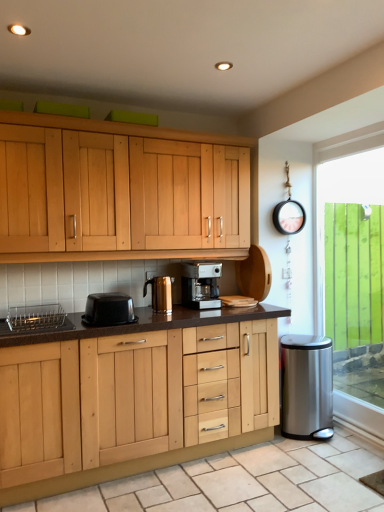
What are the coordinates of `stainless steel trash can at right, the 2th appliance positioned from the front` in the screenshot? It's located at (307, 386).

Describe the element at coordinates (160, 293) in the screenshot. I see `metallic silver kettle at center, which appears as the first kitchen appliance when viewed from the back` at that location.

Locate an element on the screen. The width and height of the screenshot is (384, 512). beige tile at lower center is located at coordinates (242, 481).

Which is more to the right, silver metallic dish rack at lower left, acting as the second appliance starting from the right, or black plastic container at center, placed as the 2th kitchen appliance when sorted from right to left?

black plastic container at center, placed as the 2th kitchen appliance when sorted from right to left.

Is silver metallic dish rack at lower left, marked as the 2th appliance in a bottom-to-top arrangement, positioned before black plastic container at center, placed as the 2th kitchen appliance when sorted from back to front?

Yes.

From the image's perspective, is silver metallic dish rack at lower left, acting as the second appliance starting from the right, located beneath black plastic container at center, which ranks as the first kitchen appliance in front-to-back order?

Correct, silver metallic dish rack at lower left, acting as the second appliance starting from the right, appears lower than black plastic container at center, which ranks as the first kitchen appliance in front-to-back order, in the image.

Considering the sizes of objects silver metallic dish rack at lower left, which is the 2th appliance from back to front, and black plastic container at center, placed as the 2th kitchen appliance when sorted from right to left, in the image provided, who is bigger, silver metallic dish rack at lower left, which is the 2th appliance from back to front, or black plastic container at center, placed as the 2th kitchen appliance when sorted from right to left,?

Bigger between the two is black plastic container at center, placed as the 2th kitchen appliance when sorted from right to left.

Is beige tile at lower center completely or partially inside silver metallic dish rack at lower left, marked as the 2th appliance in a bottom-to-top arrangement?

No, beige tile at lower center is not a part of silver metallic dish rack at lower left, marked as the 2th appliance in a bottom-to-top arrangement.

Between silver metallic dish rack at lower left, which is the 2th appliance from back to front, and beige tile at lower center, which one has less height?

Standing shorter between the two is beige tile at lower center.

Is silver metallic dish rack at lower left, which is the 2th appliance from back to front, far away from beige tile at lower center?

That's right, there is a large distance between silver metallic dish rack at lower left, which is the 2th appliance from back to front, and beige tile at lower center.

Is black plastic container at center, placed as the 2th kitchen appliance when sorted from back to front, to the right of satin silver coffee maker at center from the viewer's perspective?

No.

Between point (119, 311) and point (209, 273), which one is positioned in front?

The point (119, 311) is more forward.

Is black plastic container at center, which ranks as the first kitchen appliance in front-to-back order, taller or shorter than satin silver coffee maker at center?

Clearly, black plastic container at center, which ranks as the first kitchen appliance in front-to-back order, is shorter compared to satin silver coffee maker at center.

In the scene shown: Is satin silver coffee maker at center at the back of black plastic container at center, which ranks as the first kitchen appliance in front-to-back order?

black plastic container at center, which ranks as the first kitchen appliance in front-to-back order, does not have its back to satin silver coffee maker at center.

Is metallic silver kettle at center, marked as the second kitchen appliance in a left-to-right arrangement, outside of satin silver coffee maker at center?

Yes, metallic silver kettle at center, marked as the second kitchen appliance in a left-to-right arrangement, is outside of satin silver coffee maker at center.

Can you confirm if metallic silver kettle at center, the first kitchen appliance positioned from the right, is taller than satin silver coffee maker at center?

In fact, metallic silver kettle at center, the first kitchen appliance positioned from the right, may be shorter than satin silver coffee maker at center.

Is metallic silver kettle at center, which is the 2th kitchen appliance in front-to-back order, not near satin silver coffee maker at center?

No, metallic silver kettle at center, which is the 2th kitchen appliance in front-to-back order, is not far away from satin silver coffee maker at center.

Looking at this image, from the image's perspective, relative to green glass window at right, is silver metallic dish rack at lower left, the 1th appliance when ordered from front to back, above or below?

silver metallic dish rack at lower left, the 1th appliance when ordered from front to back, is situated lower than green glass window at right in the image.

Considering the relative sizes of silver metallic dish rack at lower left, which is the first appliance in left-to-right order, and green glass window at right in the image provided, is silver metallic dish rack at lower left, which is the first appliance in left-to-right order, shorter than green glass window at right?

Indeed, silver metallic dish rack at lower left, which is the first appliance in left-to-right order, has a lesser height compared to green glass window at right.

Which of these two, silver metallic dish rack at lower left, marked as the 2th appliance in a bottom-to-top arrangement, or green glass window at right, is bigger?

green glass window at right.

Can we say silver metallic dish rack at lower left, which is the first appliance in left-to-right order, lies outside green glass window at right?

Indeed, silver metallic dish rack at lower left, which is the first appliance in left-to-right order, is completely outside green glass window at right.

In the scene shown: Between silver metallic dish rack at lower left, which is the first appliance in left-to-right order, and metallic silver kettle at center, which is the 2th kitchen appliance in front-to-back order, which one has larger size?

With larger size is silver metallic dish rack at lower left, which is the first appliance in left-to-right order.

From a real-world perspective, is silver metallic dish rack at lower left, acting as the second appliance starting from the right, on metallic silver kettle at center, which appears as the first kitchen appliance when viewed from the back?

No.

What's the angular difference between silver metallic dish rack at lower left, which is the 2th appliance from back to front, and metallic silver kettle at center, which appears as the first kitchen appliance when viewed from the back,'s facing directions?

They differ by 0.808 degrees in their facing directions.

From the image's perspective, is silver metallic dish rack at lower left, acting as the second appliance starting from the right, located above or below metallic silver kettle at center, marked as the second kitchen appliance in a left-to-right arrangement?

Clearly, from the image's perspective, silver metallic dish rack at lower left, acting as the second appliance starting from the right, is below metallic silver kettle at center, marked as the second kitchen appliance in a left-to-right arrangement.

Based on the photo, from a real-world perspective, which is physically below, stainless steel trash can at right, marked as the 1th appliance in a back-to-front arrangement, or green glass window at right?

stainless steel trash can at right, marked as the 1th appliance in a back-to-front arrangement, is physically lower.

Is stainless steel trash can at right, which is the 2th appliance from left to right, bigger than green glass window at right?

Incorrect, stainless steel trash can at right, which is the 2th appliance from left to right, is not larger than green glass window at right.

Is stainless steel trash can at right, positioned as the 1th appliance in right-to-left order, closer to camera compared to green glass window at right?

No, it is behind green glass window at right.

From the image's perspective, between stainless steel trash can at right, marked as the 1th appliance in a back-to-front arrangement, and green glass window at right, which one is located above?

green glass window at right, from the image's perspective.

I want to click on kitchen appliance that is the 1st one above the silver metallic dish rack at lower left, which is the 2th appliance from back to front (from a real-world perspective), so click(x=108, y=310).

The width and height of the screenshot is (384, 512). In order to click on the 2nd appliance positioned above the beige tile at lower center (from the image's perspective) in this screenshot , I will do `click(33, 318)`.

When comparing their distances from stainless steel trash can at right, which is the 2th appliance from left to right, does silver metallic dish rack at lower left, the 1th appliance when ordered from front to back, or beige tile at lower center seem further?

silver metallic dish rack at lower left, the 1th appliance when ordered from front to back.

Estimate the real-world distances between objects in this image. Which object is further from stainless steel trash can at right, which is counted as the 1th appliance, starting from the bottom, black plastic container at center, placed as the 2th kitchen appliance when sorted from back to front, or metallic silver kettle at center, which appears as the first kitchen appliance when viewed from the back?

Based on the image, black plastic container at center, placed as the 2th kitchen appliance when sorted from back to front, appears to be further to stainless steel trash can at right, which is counted as the 1th appliance, starting from the bottom.

Which object lies further to the anchor point black plastic container at center, placed as the 2th kitchen appliance when sorted from right to left, metallic silver kettle at center, which is the 2th kitchen appliance in front-to-back order, or stainless steel trash can at right, which is counted as the 1th appliance, starting from the bottom?

stainless steel trash can at right, which is counted as the 1th appliance, starting from the bottom, lies further to black plastic container at center, placed as the 2th kitchen appliance when sorted from right to left, than the other object.

When comparing their distances from stainless steel trash can at right, placed as the second appliance when sorted from top to bottom, does satin silver coffee maker at center or silver metallic dish rack at lower left, which is the first appliance in left-to-right order, seem closer?

satin silver coffee maker at center lies closer to stainless steel trash can at right, placed as the second appliance when sorted from top to bottom, than the other object.

Based on their spatial positions, is black plastic container at center, which ranks as the first kitchen appliance in left-to-right order, or stainless steel trash can at right, marked as the 1th appliance in a back-to-front arrangement, further from silver metallic dish rack at lower left, which is the 2th appliance from back to front?

stainless steel trash can at right, marked as the 1th appliance in a back-to-front arrangement, is further to silver metallic dish rack at lower left, which is the 2th appliance from back to front.

From the image, which object appears to be nearer to silver metallic dish rack at lower left, positioned as the first appliance in top-to-bottom order, green glass window at right or satin silver coffee maker at center?

satin silver coffee maker at center is positioned closer to the anchor silver metallic dish rack at lower left, positioned as the first appliance in top-to-bottom order.

Based on their spatial positions, is silver metallic dish rack at lower left, positioned as the first appliance in top-to-bottom order, or green glass window at right closer to satin silver coffee maker at center?

silver metallic dish rack at lower left, positioned as the first appliance in top-to-bottom order, is positioned closer to the anchor satin silver coffee maker at center.

Based on their spatial positions, is metallic silver kettle at center, marked as the second kitchen appliance in a left-to-right arrangement, or black plastic container at center, which ranks as the first kitchen appliance in front-to-back order, closer to silver metallic dish rack at lower left, marked as the 2th appliance in a bottom-to-top arrangement?

black plastic container at center, which ranks as the first kitchen appliance in front-to-back order, is positioned closer to the anchor silver metallic dish rack at lower left, marked as the 2th appliance in a bottom-to-top arrangement.

At what (x,y) coordinates should I click in order to perform the action: click on appliance situated between metallic silver kettle at center, which is the 2th kitchen appliance in front-to-back order, and green glass window at right from left to right. Please return your answer as a coordinate pair (x, y). The width and height of the screenshot is (384, 512). Looking at the image, I should click on (307, 386).

Where is `window positioned between beige tile at lower center and satin silver coffee maker at center from near to far`? The width and height of the screenshot is (384, 512). window positioned between beige tile at lower center and satin silver coffee maker at center from near to far is located at coordinates (352, 270).

You are a GUI agent. You are given a task and a screenshot of the screen. Output one action in this format:
    pyautogui.click(x=<x>, y=<y>)
    Task: Click on the kitchen appliance between beige tile at lower center and metallic silver kettle at center, which appears as the first kitchen appliance when viewed from the back, from front to back
    The width and height of the screenshot is (384, 512).
    Given the screenshot: What is the action you would take?
    coord(108,310)

Locate an element on the screen. The width and height of the screenshot is (384, 512). home appliance located between silver metallic dish rack at lower left, marked as the 2th appliance in a bottom-to-top arrangement, and green glass window at right in the left-right direction is located at coordinates (201, 285).